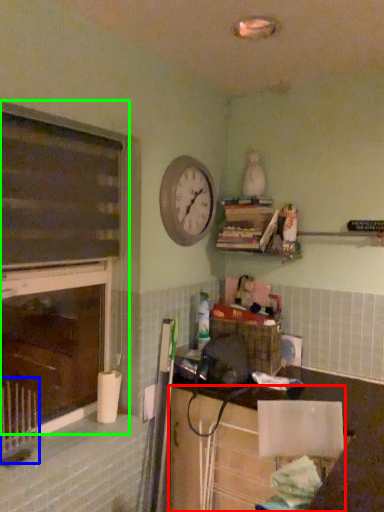
Question: Based on their relative distances, which object is nearer to cabinetry (highlighted by a red box)? Choose from radiator (highlighted by a blue box) and window frame (highlighted by a green box).

Choices:
 (A) radiator
 (B) window frame

Answer: (B)